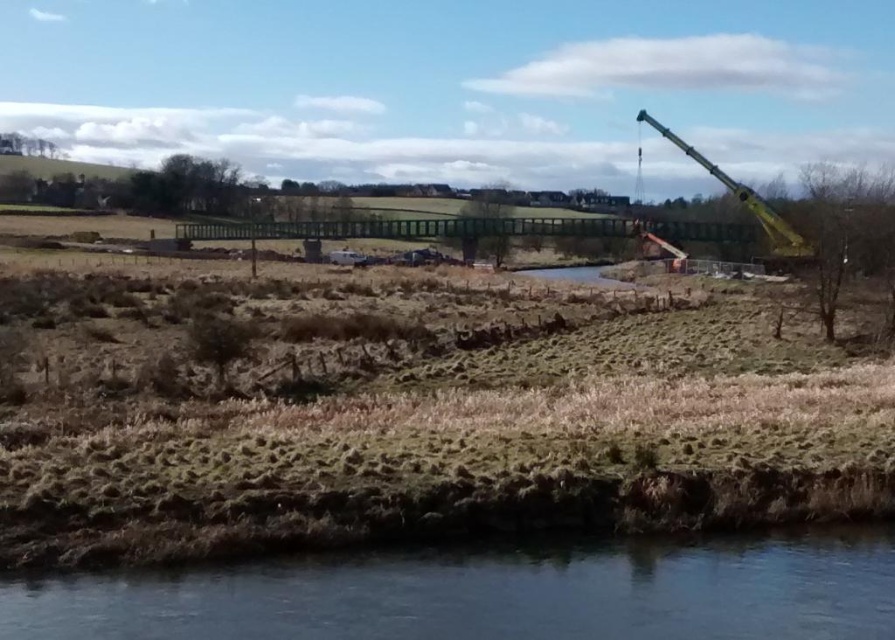
Does clear water at lower left have a greater height compared to clear water at center?

No.

Can you confirm if clear water at lower left is positioned above clear water at center?

Actually, clear water at lower left is below clear water at center.

Where is `clear water at lower left`? This screenshot has height=640, width=895. clear water at lower left is located at coordinates (491, 593).

Can you confirm if clear water at lower left is positioned below yellow metallic crane at upper right?

Correct, clear water at lower left is located below yellow metallic crane at upper right.

The width and height of the screenshot is (895, 640). In order to click on clear water at lower left in this screenshot , I will do `click(491, 593)`.

Can you confirm if yellow metallic crane at upper right is taller than clear water at center?

Yes.

Who is positioned more to the left, yellow metallic crane at upper right or clear water at center?

Positioned to the left is clear water at center.

Measure the distance between yellow metallic crane at upper right and camera.

yellow metallic crane at upper right and camera are 120.94 feet apart from each other.

Where is `yellow metallic crane at upper right`? This screenshot has width=895, height=640. yellow metallic crane at upper right is located at coordinates (748, 205).